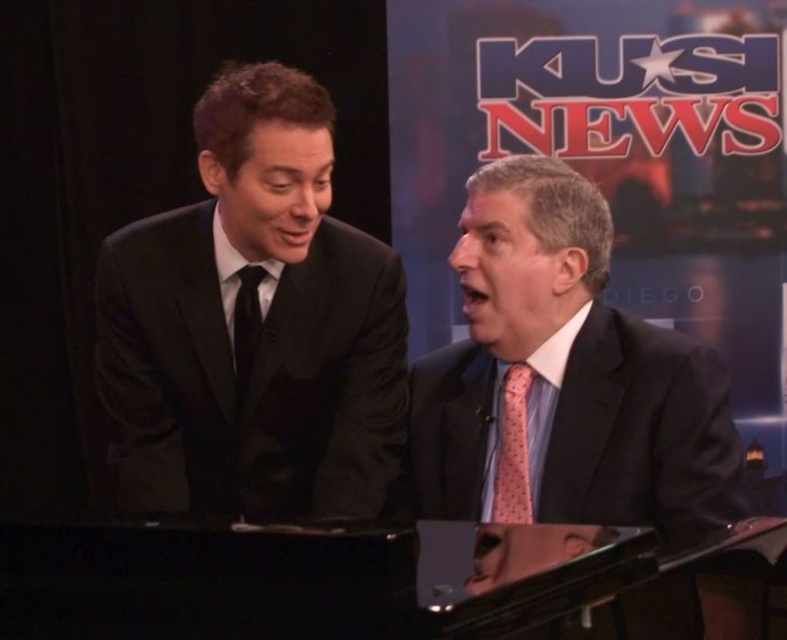
You are a camera operator trying to capture a closeup shot of both individuals in the scene. You have two markers labeled point A at point (307, 289) and point B at point (482, 422). If you want to focus on the person who is closer to the camera, which point should you adjust your camera to focus on?

Point B at point (482, 422) is closer to the camera than point A at point (307, 289), so you should adjust your camera to focus on point B at point (482, 422) to capture the person who is closer.